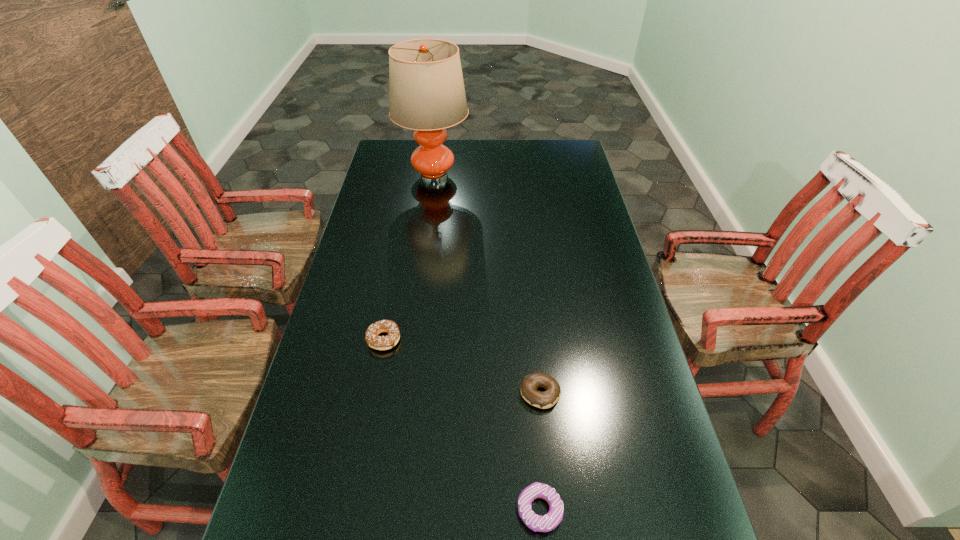
Where is `lamp`? lamp is located at coordinates (426, 89).

Find the location of a particular element. The height and width of the screenshot is (540, 960). the tallest object is located at coordinates (426, 89).

The width and height of the screenshot is (960, 540). Find the location of `the third nearest object`. the third nearest object is located at coordinates (373, 340).

I want to click on the farthest doughnut, so click(x=373, y=340).

I want to click on the third farthest object, so click(x=542, y=399).

Where is `the nearest doughnut`? Image resolution: width=960 pixels, height=540 pixels. the nearest doughnut is located at coordinates (546, 523).

Identify the location of free region located on the right of the lamp. (492, 176).

Find the location of `vacant position located 0.110m on the back of the farthest doughnut`. vacant position located 0.110m on the back of the farthest doughnut is located at coordinates (392, 297).

The height and width of the screenshot is (540, 960). Identify the location of vacant area situated 0.250m on the left of the second nearest doughnut. (420, 393).

In order to click on vacant point located 0.180m on the back of the nearest doughnut in this screenshot , I will do `click(531, 408)`.